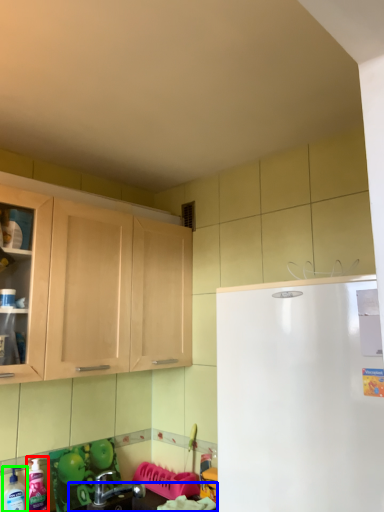
Question: Estimate the real-world distances between objects in this image. Which object is closer to cleaning product (highlighted by a red box), counter top (highlighted by a blue box) or cleaning product (highlighted by a green box)?

Choices:
 (A) counter top
 (B) cleaning product

Answer: (B)